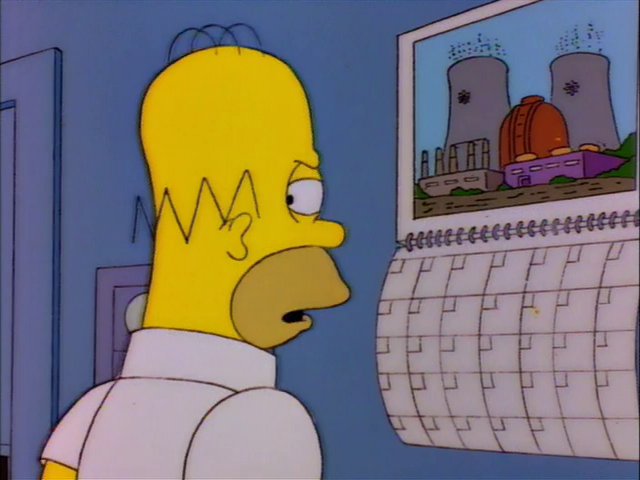
The height and width of the screenshot is (480, 640). In order to click on blue wall in this screenshot , I will do `click(118, 164)`.